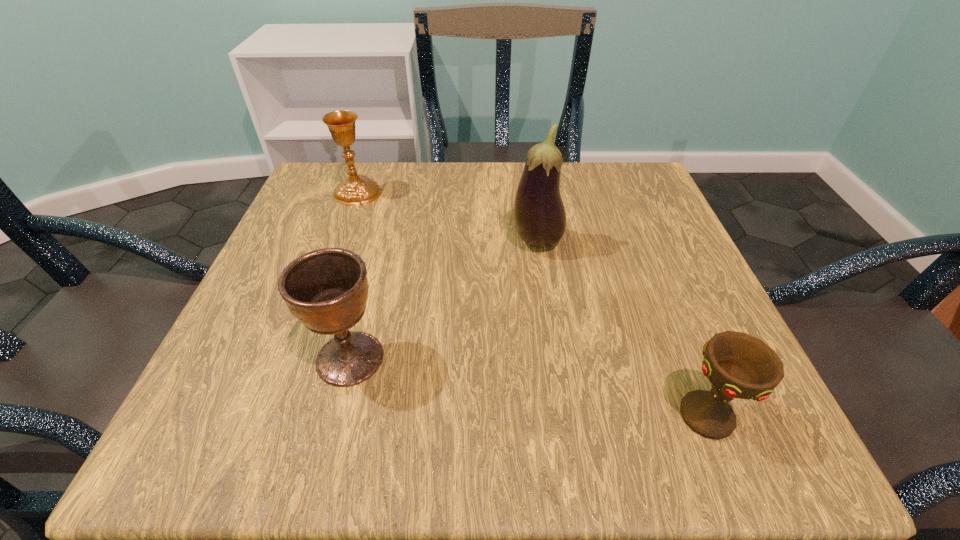
The image size is (960, 540). I want to click on vacant space that satisfies the following two spatial constraints: 1. on the front side of the third object from left to right; 2. on the right side of the farthest chalice, so click(x=339, y=242).